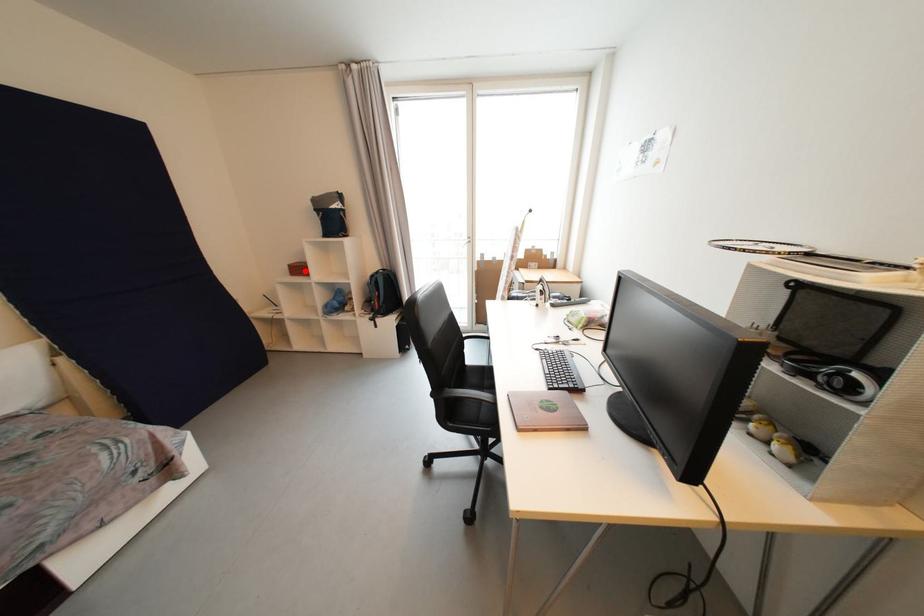
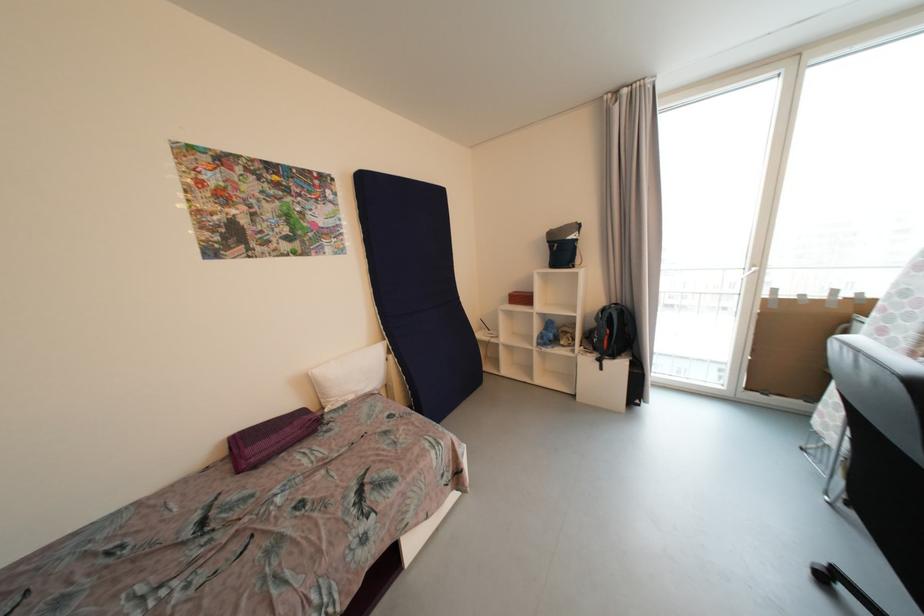
The point at the highlighted location is marked in the first image. Where is the corresponding point in the second image?

(528, 300)